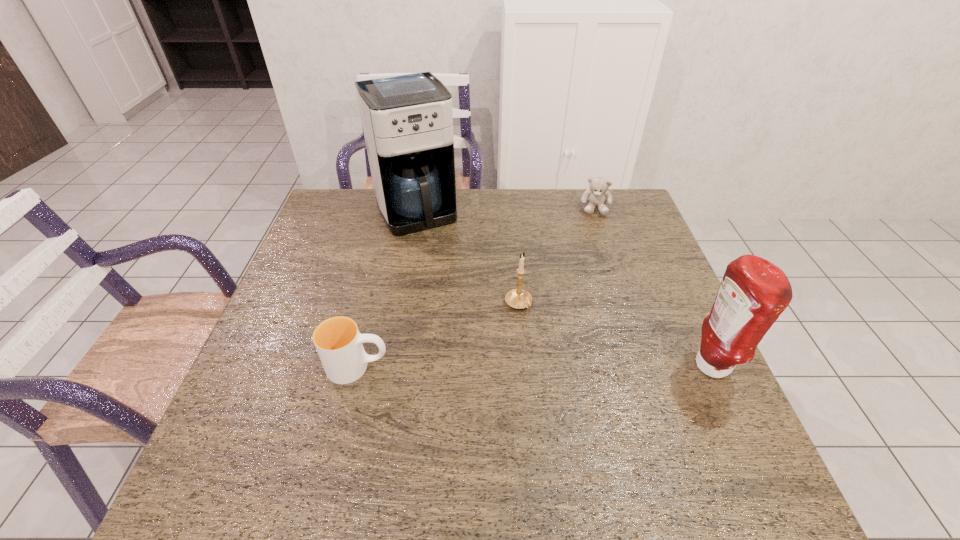
Where is `object that is the fourth closest to the tallest object`? This screenshot has height=540, width=960. object that is the fourth closest to the tallest object is located at coordinates (753, 293).

Identify which object is the second closest to the condiment. Please provide its 2D coordinates. Your answer should be formatted as a tuple, i.e. [(x, y)], where the tuple contains the x and y coordinates of a point satisfying the conditions above.

[(596, 196)]

In order to click on free space that satisfies the following two spatial constraints: 1. on the front side of the second tallest object; 2. on the left side of the tallest object in this screenshot , I will do `click(387, 366)`.

The height and width of the screenshot is (540, 960). What are the coordinates of `free space that satisfies the following two spatial constraints: 1. on the front side of the third shortest object; 2. on the right side of the tallest object` in the screenshot? It's located at (398, 304).